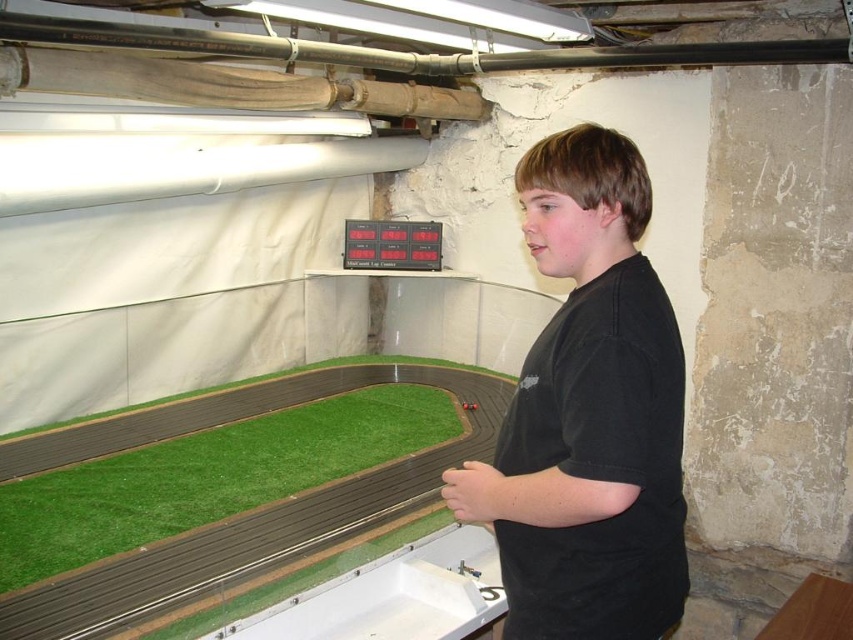
You are organizing a model train display and need to place a new accessory. You have the black matte shirt at center and the green artificial turf at lower left in view. Which object is closer to you?

The black matte shirt at center is closer to you because it is in front of the green artificial turf at lower left.

You are a model train enthusiast who wants to place a new model train car on the black matte shirt at center and the green artificial turf at lower left. Which of these two objects is positioned higher in the scene?

The black matte shirt at center is located above the green artificial turf at lower left, so it is positioned higher in the scene.

You are organizing a model train display and need to place the black matte shirt at center and the green artificial turf at lower left. According to the scene, which object is positioned to the right of the other?

The black matte shirt at center is to the right of the green artificial turf at lower left.